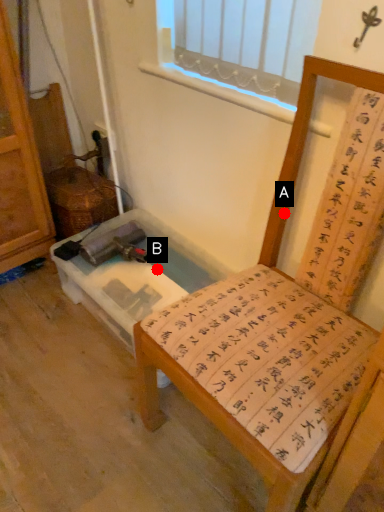
Question: Two points are circled on the image, labeled by A and B beside each circle. Which point is farther to the camera?

Choices:
 (A) A is further
 (B) B is further

Answer: (B)